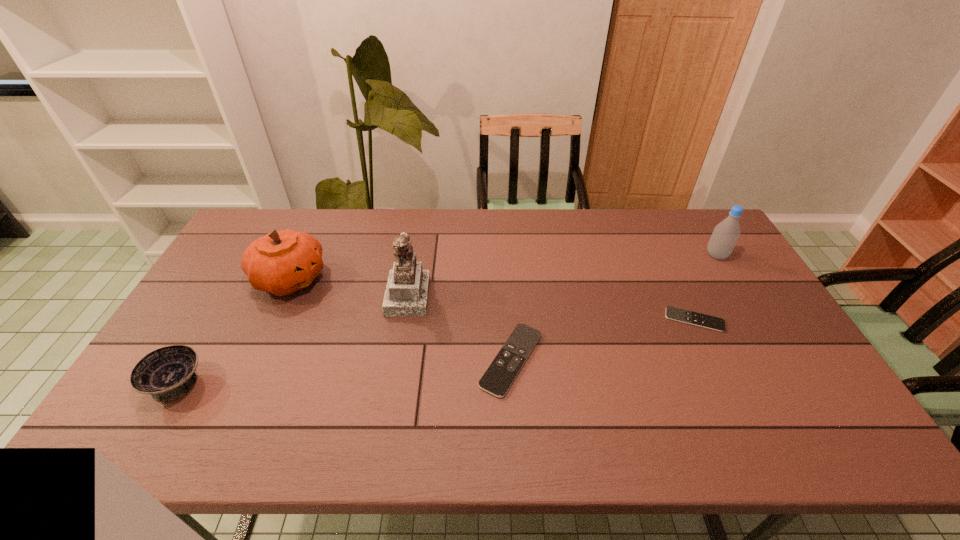
Image resolution: width=960 pixels, height=540 pixels. Find the location of `the second shortest object`. the second shortest object is located at coordinates (501, 373).

At what (x,y) coordinates should I click in order to perform the action: click on the left remote control. Please return your answer as a coordinate pair (x, y). The height and width of the screenshot is (540, 960). Looking at the image, I should click on (501, 373).

Where is `the right remote control`? The image size is (960, 540). the right remote control is located at coordinates click(x=681, y=315).

The width and height of the screenshot is (960, 540). I want to click on the shorter remote control, so click(681, 315).

Where is `pumpkin`? The width and height of the screenshot is (960, 540). pumpkin is located at coordinates (283, 262).

Locate an element on the screen. This screenshot has width=960, height=540. the tallest object is located at coordinates (407, 289).

I want to click on the third object from left to right, so click(407, 289).

The height and width of the screenshot is (540, 960). Find the location of `bottle`. bottle is located at coordinates (725, 235).

Find the location of a particular element. This screenshot has height=540, width=960. the third shortest object is located at coordinates (167, 373).

Image resolution: width=960 pixels, height=540 pixels. I want to click on free point located 0.080m on the left of the second shortest object, so click(448, 360).